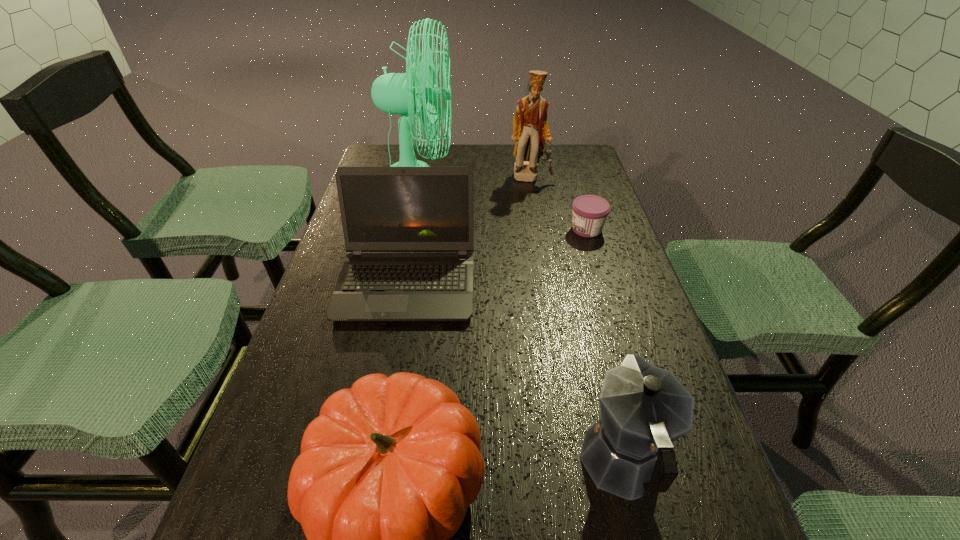
Where is `free area in between the nutcracker and the coffeepot`? free area in between the nutcracker and the coffeepot is located at coordinates (577, 321).

Identify the location of free spot between the coffeepot and the tallest object. Image resolution: width=960 pixels, height=540 pixels. (521, 322).

Where is `blank region between the shortest object and the tallest object`? This screenshot has width=960, height=540. blank region between the shortest object and the tallest object is located at coordinates (503, 205).

At what (x,y) coordinates should I click in order to perform the action: click on vacant space in between the tallest object and the third farthest object. Please return your answer as a coordinate pair (x, y). This screenshot has width=960, height=540. Looking at the image, I should click on (503, 205).

Locate which object ranks fourth in proximity to the pumpkin. Please provide its 2D coordinates. Your answer should be formatted as a tuple, i.e. [(x, y)], where the tuple contains the x and y coordinates of a point satisfying the conditions above.

[(395, 93)]

Select which object appears as the fourth closest to the pumpkin. Please provide its 2D coordinates. Your answer should be formatted as a tuple, i.e. [(x, y)], where the tuple contains the x and y coordinates of a point satisfying the conditions above.

[(395, 93)]

What are the coordinates of `free point that satisfies the following two spatial constraints: 1. on the front label of the fourth nearest object; 2. on the screen of the fourth farthest object` in the screenshot? It's located at (603, 282).

The width and height of the screenshot is (960, 540). In order to click on free spot that satisfies the following two spatial constraints: 1. at the spout of the coffeepot; 2. in front of the fan to blow air in this screenshot , I will do `click(554, 181)`.

The image size is (960, 540). In order to click on vacant space that satisfies the following two spatial constraints: 1. on the front-facing side of the nutcracker; 2. in front of the fan to blow air in this screenshot , I will do `click(532, 181)`.